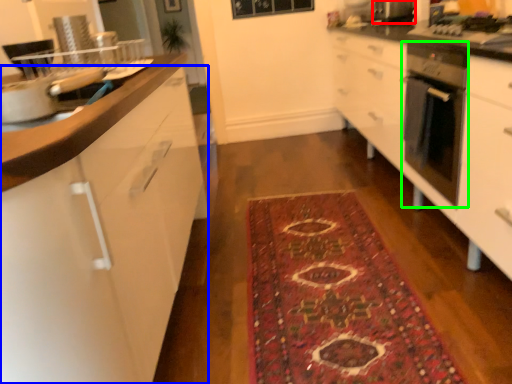
Question: Which object is positioned farthest from appliance (highlighted by a red box)? Select from cabinetry (highlighted by a blue box) and home appliance (highlighted by a green box).

Choices:
 (A) cabinetry
 (B) home appliance

Answer: (A)